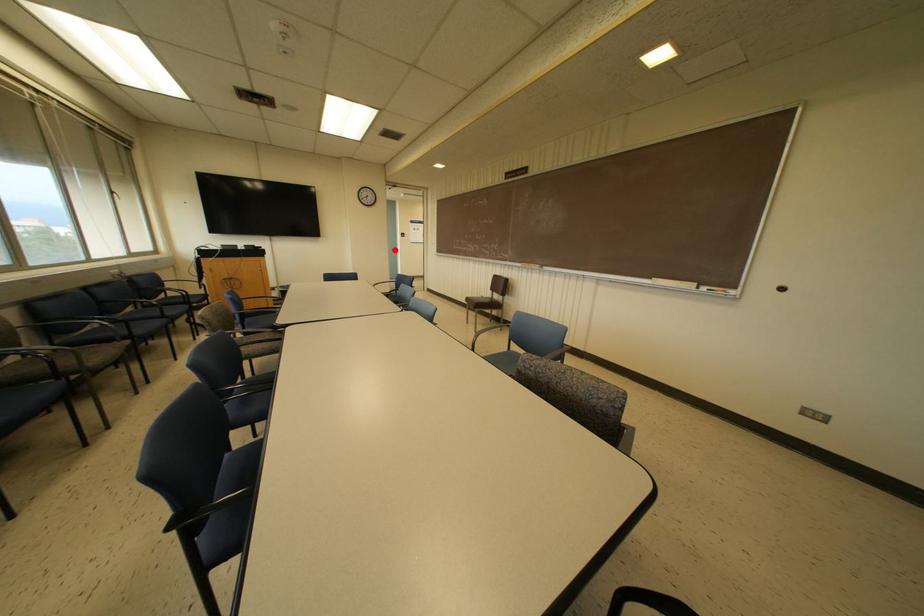
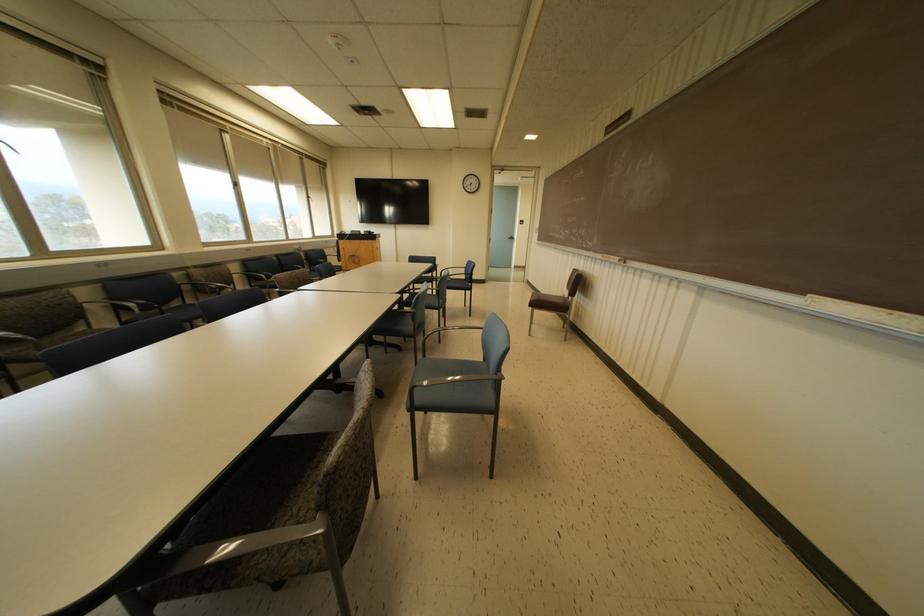
The point at the highlighted location is marked in the first image. Where is the corresponding point in the second image?

(512, 238)